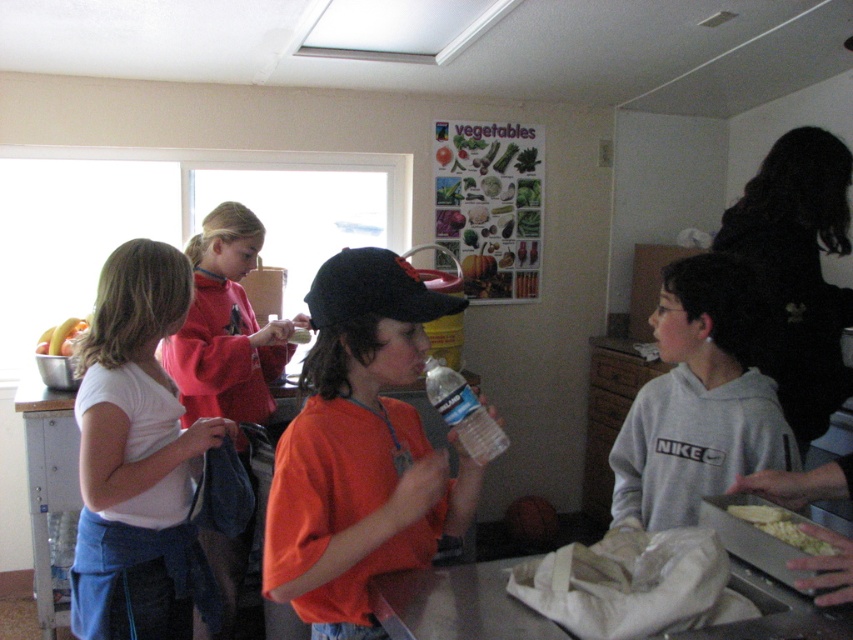
Question: Does white cotton shirt at left have a lesser width compared to yellow plastic bag at lower left?

Choices:
 (A) yes
 (B) no

Answer: (B)

Question: Is orange cotton shirt at center further to camera compared to white plastic exhaust hood at upper center?

Choices:
 (A) no
 (B) yes

Answer: (A)

Question: Which point is farther from the camera taking this photo?

Choices:
 (A) (248, 241)
 (B) (796, 545)
 (C) (834, 300)
 (D) (64, 353)

Answer: (D)

Question: Which point is farther to the camera?

Choices:
 (A) (759, 268)
 (B) (209, 298)
 (C) (387, 28)
 (D) (59, 337)

Answer: (C)

Question: Estimate the real-world distances between objects in this image. Which object is closer to the gray fleece hoodie at right?

Choices:
 (A) yellowish matte corn at lower right
 (B) white plastic exhaust hood at upper center
 (C) white cotton shirt at left
 (D) black fabric at right

Answer: (A)

Question: Is white plastic exhaust hood at upper center to the right of yellow plastic bag at lower left from the viewer's perspective?

Choices:
 (A) no
 (B) yes

Answer: (B)